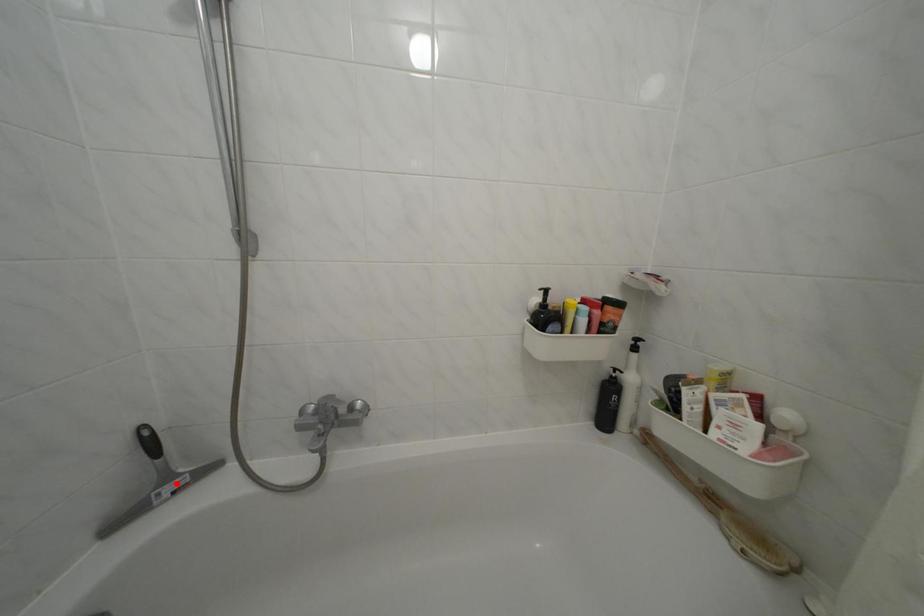
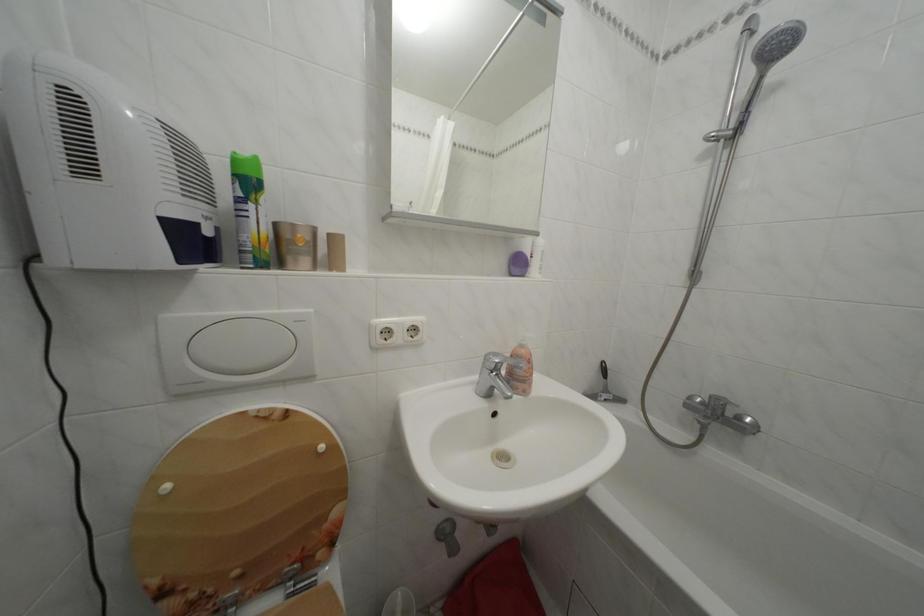
Question: I am providing you with two images of the same scene from different viewpoints. Image1 has a red point marked. In image2, the corresponding 3D location appears at what relative position? Reply with the corresponding letter.

Choices:
 (A) Closer
 (B) Farther

Answer: (B)